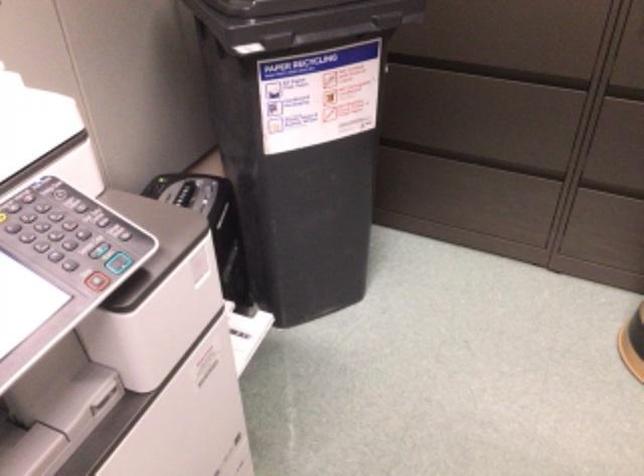
The image size is (644, 476). Identify the location of black bin lid. (298, 21).